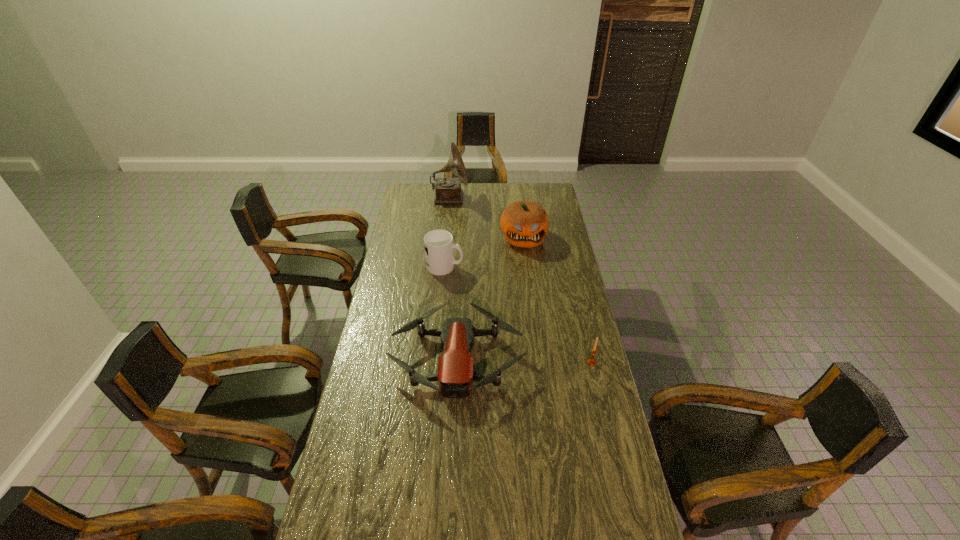
Locate an element on the screen. This screenshot has height=540, width=960. vacant position in the image that satisfies the following two spatial constraints: 1. on the horn of the farthest object; 2. on the left side of the rightmost object is located at coordinates (433, 362).